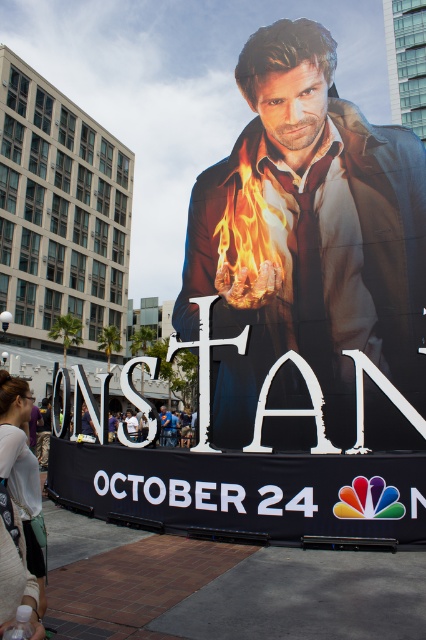
Question: Does smooth leather jacket at center appear on the left side of white textured shirt at lower left?

Choices:
 (A) no
 (B) yes

Answer: (A)

Question: Which point appears farthest from the camera in this image?

Choices:
 (A) (20, 394)
 (B) (264, 56)

Answer: (B)

Question: Among these objects, which one is farthest from the camera?

Choices:
 (A) white textured shirt at lower left
 (B) smooth leather jacket at center

Answer: (B)

Question: Does smooth leather jacket at center have a smaller size compared to white textured shirt at lower left?

Choices:
 (A) yes
 (B) no

Answer: (A)

Question: Does smooth leather jacket at center appear on the right side of white textured shirt at lower left?

Choices:
 (A) no
 (B) yes

Answer: (B)

Question: Which object is farther from the camera taking this photo?

Choices:
 (A) white textured shirt at lower left
 (B) smooth leather jacket at center

Answer: (B)